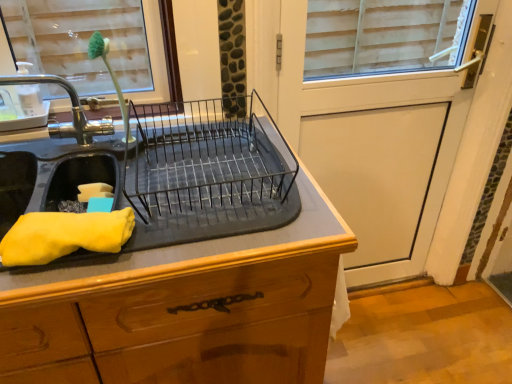
Question: Is black metal dish rack at center facing towards brushed metal tap at left?

Choices:
 (A) yes
 (B) no

Answer: (B)

Question: Considering the relative sizes of black metal dish rack at center and brushed metal tap at left in the image provided, is black metal dish rack at center taller than brushed metal tap at left?

Choices:
 (A) no
 (B) yes

Answer: (A)

Question: From the image's perspective, is black metal dish rack at center located beneath brushed metal tap at left?

Choices:
 (A) no
 (B) yes

Answer: (B)

Question: Does black metal dish rack at center have a lesser height compared to brushed metal tap at left?

Choices:
 (A) no
 (B) yes

Answer: (B)

Question: Is black metal dish rack at center closer to the viewer compared to brushed metal tap at left?

Choices:
 (A) yes
 (B) no

Answer: (A)

Question: Is black metal dish rack at center smaller than brushed metal tap at left?

Choices:
 (A) yes
 (B) no

Answer: (B)

Question: Is the position of yellow fabric at left more distant than that of black rubber mat at center?

Choices:
 (A) yes
 (B) no

Answer: (A)

Question: From the image's perspective, is yellow fabric at left under black rubber mat at center?

Choices:
 (A) no
 (B) yes

Answer: (A)

Question: Does yellow fabric at left contain black rubber mat at center?

Choices:
 (A) yes
 (B) no

Answer: (B)

Question: Is yellow fabric at left aimed at black rubber mat at center?

Choices:
 (A) no
 (B) yes

Answer: (A)

Question: Is yellow fabric at left completely or partially outside of black rubber mat at center?

Choices:
 (A) yes
 (B) no

Answer: (A)

Question: Can you confirm if yellow fabric at left is smaller than black rubber mat at center?

Choices:
 (A) yes
 (B) no

Answer: (A)

Question: Does white matte screen door at upper right have a lesser width compared to black metal dish rack at center?

Choices:
 (A) no
 (B) yes

Answer: (B)